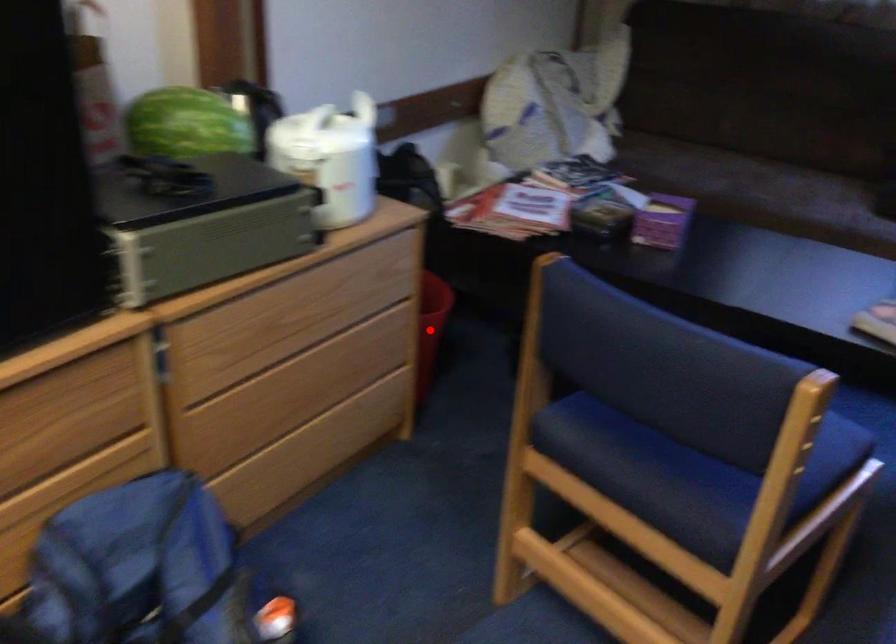
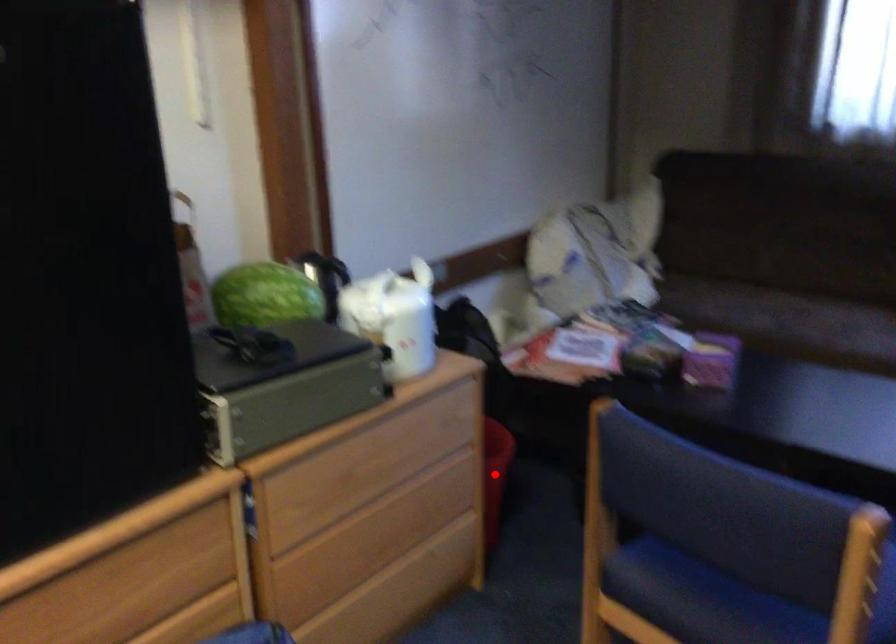
I am providing you with two images of the same scene from different viewpoints. A red point is marked on the first image and another point is marked on the second image. Are the points marked in image1 and image2 representing the same 3D position?

Yes